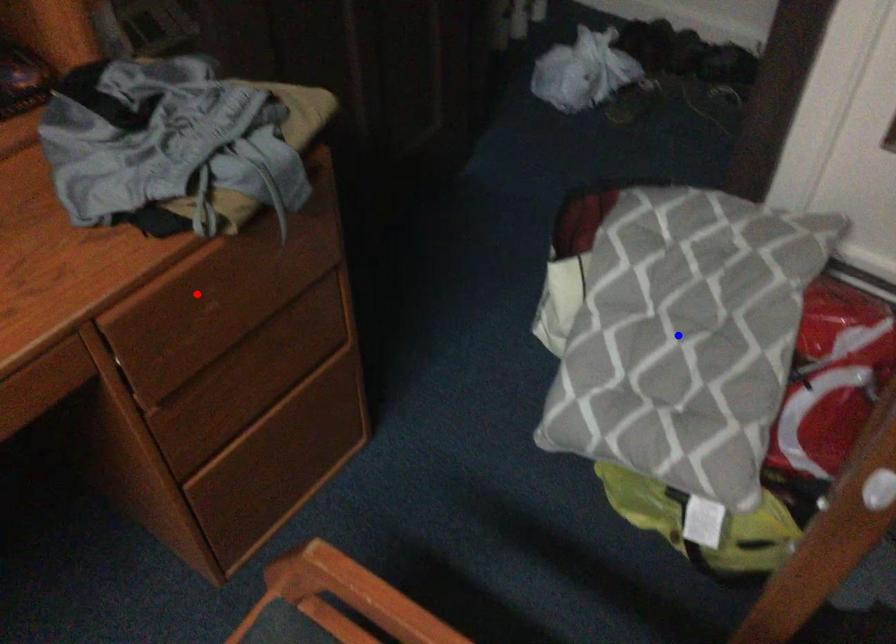
Question: Two points are marked on the image. Which point is closer to the camera?

Choices:
 (A) Blue point is closer.
 (B) Red point is closer.

Answer: (B)